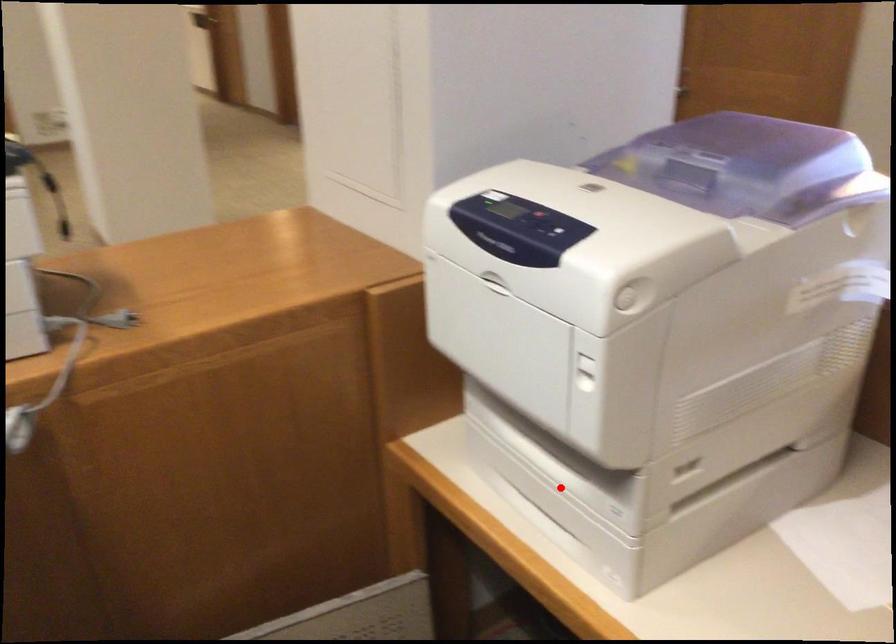
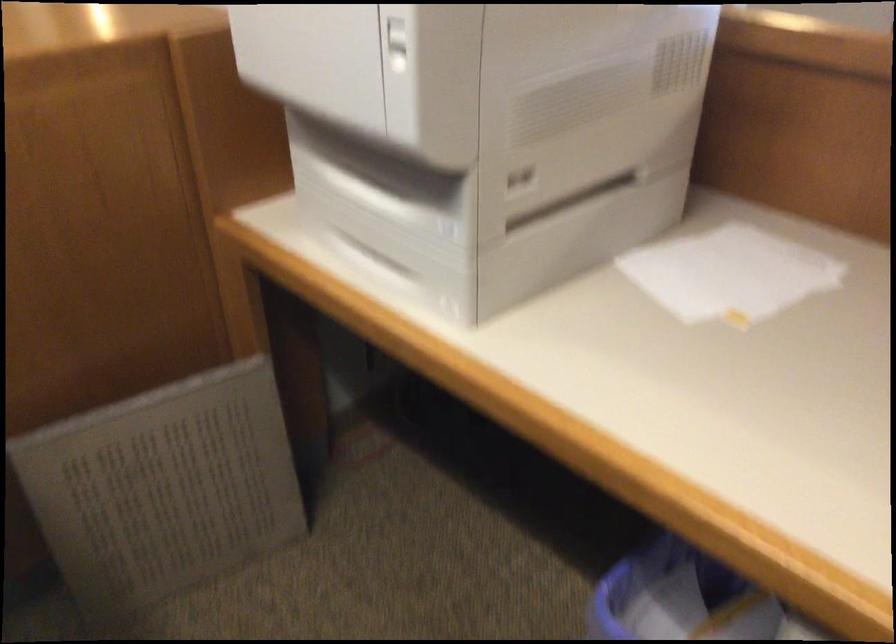
The point at the highlighted location is marked in the first image. Where is the corresponding point in the second image?

(391, 220)